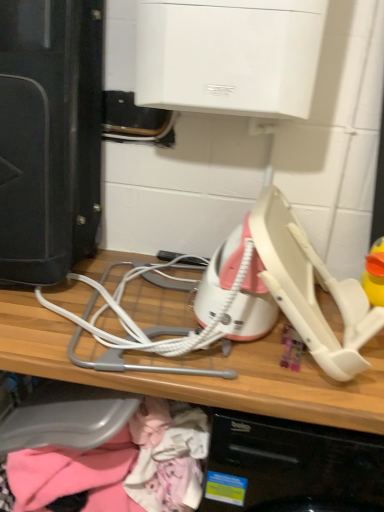
Locate an element on the screen. pink fabric at lower left is located at coordinates (121, 465).

Find the location of a particular element. This screenshot has width=384, height=512. black plastic speaker at left is located at coordinates (49, 136).

In terms of width, does white plastic computer at center look wider or thinner when compared to pink fabric at lower left?

Considering their sizes, white plastic computer at center looks broader than pink fabric at lower left.

Is white plastic computer at center taller than pink fabric at lower left?

Yes, white plastic computer at center is taller than pink fabric at lower left.

The height and width of the screenshot is (512, 384). What are the coordinates of `clothing behind the white plastic computer at center` in the screenshot? It's located at (121, 465).

From the picture: Is black plastic speaker at left completely or partially outside of pink fabric at lower left?

Absolutely, black plastic speaker at left is external to pink fabric at lower left.

Is black plastic speaker at left looking in the opposite direction of pink fabric at lower left?

black plastic speaker at left does not have its back to pink fabric at lower left.

Is black plastic speaker at left taller than pink fabric at lower left?

Correct, black plastic speaker at left is much taller as pink fabric at lower left.

From the image's perspective, is pink fabric at lower left below black plastic speaker at left?

Yes.

Are pink fabric at lower left and black plastic speaker at left located far from each other?

No, pink fabric at lower left is in close proximity to black plastic speaker at left.

Considering the positions of point (48, 482) and point (93, 100), is point (48, 482) closer or farther from the camera than point (93, 100)?

Clearly, point (48, 482) is closer to the camera than point (93, 100).

Between pink fabric at lower left and black plastic speaker at left, which one appears on the right side from the viewer's perspective?

pink fabric at lower left is more to the right.

Find the location of a particular element. home appliance above the white plastic computer at center (from the image's perspective) is located at coordinates (49, 136).

From the image's perspective, is black plastic speaker at left located above white plastic computer at center?

Yes, from the image's perspective, black plastic speaker at left is on top of white plastic computer at center.

Between black plastic speaker at left and white plastic computer at center, which one appears on the left side from the viewer's perspective?

Positioned to the left is black plastic speaker at left.

Do you think black plastic speaker at left is within white plastic computer at center, or outside of it?

black plastic speaker at left is located beyond the bounds of white plastic computer at center.

Considering the positions of objects pink fabric at lower left and white plastic computer at center in the image provided, who is more to the right, pink fabric at lower left or white plastic computer at center?

From the viewer's perspective, white plastic computer at center appears more on the right side.

Is point (107, 473) positioned after point (144, 258)?

No, (107, 473) is in front of (144, 258).

Is white plastic computer at center oriented towards black plastic speaker at left?

No, white plastic computer at center is not turned towards black plastic speaker at left.

Based on their sizes in the image, would you say white plastic computer at center is bigger or smaller than black plastic speaker at left?

In the image, white plastic computer at center appears to be larger than black plastic speaker at left.

From their relative heights in the image, would you say white plastic computer at center is taller or shorter than black plastic speaker at left?

Considering their sizes, white plastic computer at center has more height than black plastic speaker at left.

Is white plastic computer at center further to the viewer compared to black plastic speaker at left?

No, the depth of white plastic computer at center is less than that of black plastic speaker at left.

Where is `computer located underneath the pink fabric at lower left (from a real-world perspective)`? computer located underneath the pink fabric at lower left (from a real-world perspective) is located at coordinates (203, 368).

This screenshot has width=384, height=512. Identify the location of home appliance above the pink fabric at lower left (from a real-world perspective). (49, 136).

When comparing their distances from black plastic speaker at left, does pink fabric at lower left or white plastic computer at center seem closer?

The object closer to black plastic speaker at left is white plastic computer at center.

Considering their positions, is pink fabric at lower left positioned closer to white plastic computer at center than black plastic speaker at left?

pink fabric at lower left lies closer to white plastic computer at center than the other object.

Considering their positions, is white plastic computer at center positioned further to black plastic speaker at left than pink fabric at lower left?

pink fabric at lower left is positioned further to the anchor black plastic speaker at left.

Looking at the image, which one is located further to pink fabric at lower left, black plastic speaker at left or white plastic computer at center?

black plastic speaker at left is positioned further to the anchor pink fabric at lower left.

From the image, which object appears to be farther from white plastic computer at center, black plastic speaker at left or pink fabric at lower left?

The object further to white plastic computer at center is black plastic speaker at left.

Which object lies nearer to the anchor point pink fabric at lower left, white plastic computer at center or black plastic speaker at left?

Among the two, white plastic computer at center is located nearer to pink fabric at lower left.

The height and width of the screenshot is (512, 384). What are the coordinates of `computer between black plastic speaker at left and pink fabric at lower left in the vertical direction` in the screenshot? It's located at (203, 368).